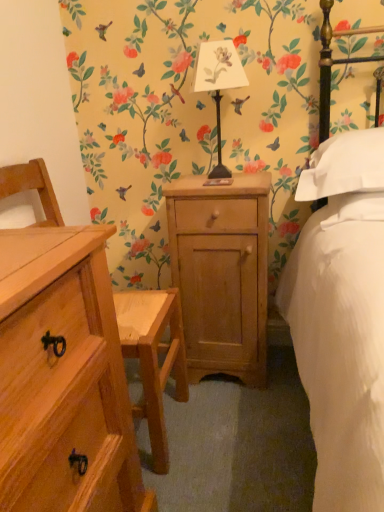
Question: In the image, is white soft pillow at upper right, placed as the second pillow when sorted from top to bottom, on the left side or the right side of metallic black lamp at center?

Choices:
 (A) left
 (B) right

Answer: (B)

Question: From the image's perspective, is white soft pillow at upper right, which is the 1th pillow in bottom-to-top order, located above or below metallic black lamp at center?

Choices:
 (A) below
 (B) above

Answer: (A)

Question: Estimate the real-world distances between objects in this image. Which object is farther from the white soft pillow at upper right, placed as the second pillow when sorted from top to bottom?

Choices:
 (A) natural wood chest of drawers at left
 (B) metallic black lamp at center
 (C) white soft pillow at right, the first pillow from the top
 (D) natural wood cabinet at center

Answer: (A)

Question: Based on their relative distances, which object is farther from the natural wood chest of drawers at left?

Choices:
 (A) natural wood cabinet at center
 (B) white soft pillow at upper right, placed as the second pillow when sorted from top to bottom
 (C) white soft pillow at right, the first pillow from the top
 (D) metallic black lamp at center

Answer: (D)